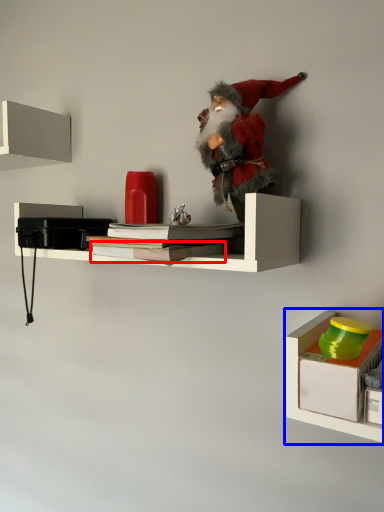
Question: Among these objects, which one is farthest to the camera, book (highlighted by a red box) or shelf (highlighted by a blue box)?

Choices:
 (A) book
 (B) shelf

Answer: (A)